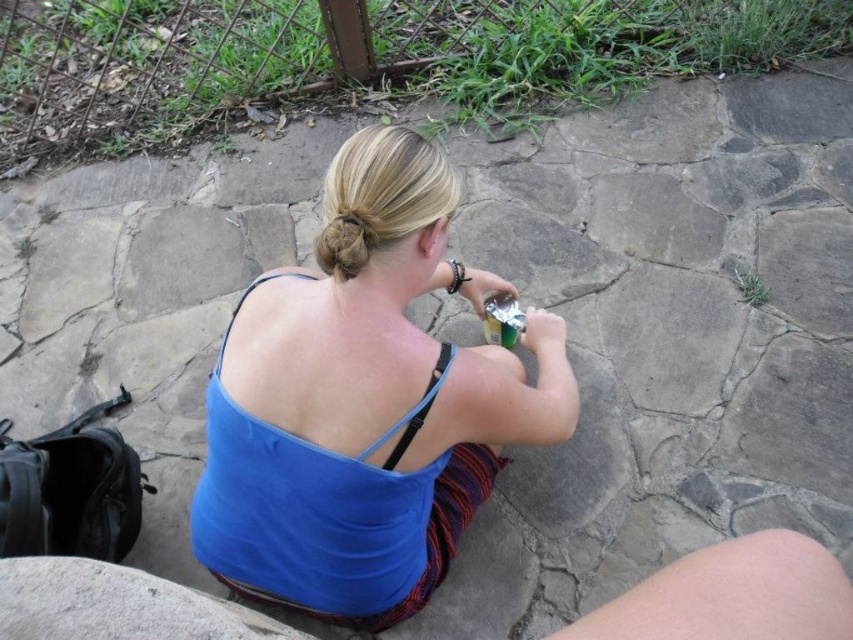
You are a photographer trying to capture the person in the image without including the skinny white leg at lower right in the frame. Based on the coordinates provided, where should you position your camera to avoid it?

To avoid including the skinny white leg at lower right located at point (732,595), position the camera slightly to the left or lower to ensure the leg is outside the frame.

You are a photographer standing at a distance of 24 inches from the subject. You want to take a closeup shot of the skinny white leg at lower right. Is the current distance sufficient for a clear closeup without needing to move closer?

The distance of skinny white leg at lower right from viewer is 23.70 inches, which is just under 24 inches. Since you are standing at exactly 24 inches away, you are slightly farther than the object is from the viewer. To ensure a clear closeup, you might need to move a tiny bit closer to be within the 23.70 inch range.

Please look at the image and focus on the coordinates point at (364, 406). What object is located there?

The blue fabric tank top at center is located at point (364, 406).